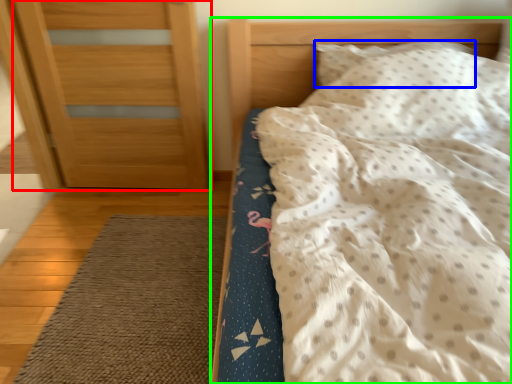
Question: Considering the real-world distances, which object is farthest from door (highlighted by a red box)? pillow (highlighted by a blue box) or bed (highlighted by a green box)?

Choices:
 (A) pillow
 (B) bed

Answer: (A)